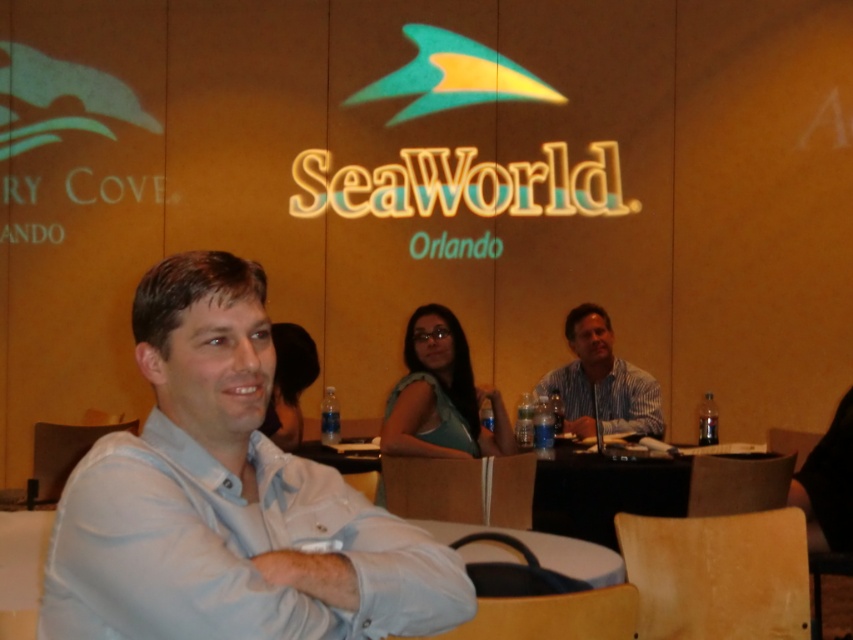
Does point (585, 541) come closer to viewer compared to point (595, 326)?

Yes, it is.

Which is in front, point (546, 536) or point (654, 396)?

Point (546, 536)

Image resolution: width=853 pixels, height=640 pixels. Describe the element at coordinates (21, 570) in the screenshot. I see `white plastic table at center` at that location.

The image size is (853, 640). In order to click on white plastic table at center in this screenshot , I will do `click(21, 570)`.

Which is above, light blue shirt at center or striped cotton shirt at center?

striped cotton shirt at center

How distant is light blue shirt at center from striped cotton shirt at center?

3.32 meters

This screenshot has width=853, height=640. What do you see at coordinates (227, 499) in the screenshot? I see `light blue shirt at center` at bounding box center [227, 499].

Where is `light blue shirt at center`? Image resolution: width=853 pixels, height=640 pixels. light blue shirt at center is located at coordinates (227, 499).

Image resolution: width=853 pixels, height=640 pixels. I want to click on light blue shirt at center, so click(227, 499).

Which is above, light blue shirt at center or white plastic table at center?

light blue shirt at center is higher up.

You are a GUI agent. You are given a task and a screenshot of the screen. Output one action in this format:
    pyautogui.click(x=<x>, y=<y>)
    Task: Click on the light blue shirt at center
    This screenshot has height=640, width=853.
    Given the screenshot: What is the action you would take?
    pyautogui.click(x=227, y=499)